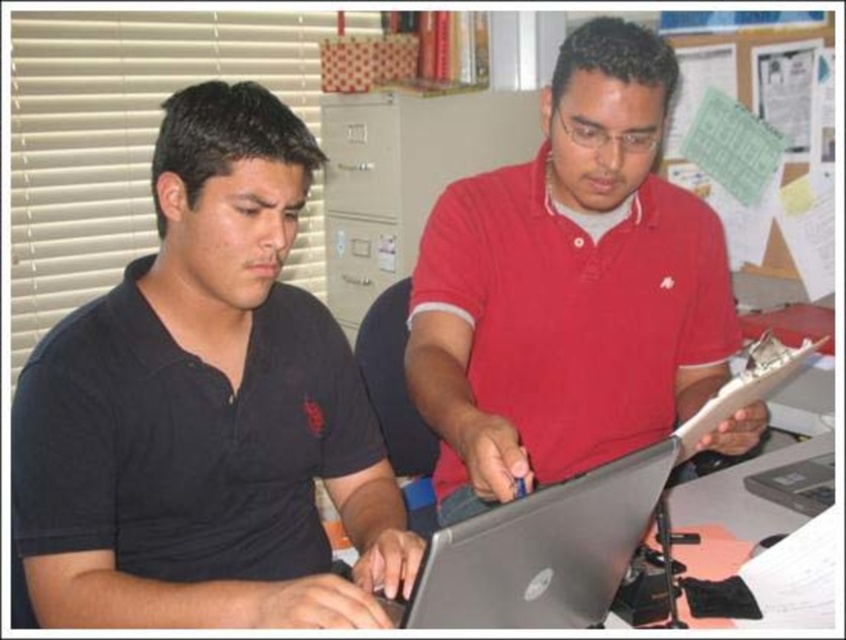
Question: Can you confirm if black matte shirt at left is wider than silver metallic laptop at center?

Choices:
 (A) no
 (B) yes

Answer: (B)

Question: Is silver metallic laptop at center positioned before white paper at lower right?

Choices:
 (A) yes
 (B) no

Answer: (A)

Question: Is matte red shirt at center closer to camera compared to matte gray file cabinet at center?

Choices:
 (A) yes
 (B) no

Answer: (A)

Question: Based on their relative distances, which object is farther from the white paper at lower right?

Choices:
 (A) black matte shirt at left
 (B) matte gray file cabinet at center
 (C) matte red shirt at center
 (D) silver metallic laptop at center

Answer: (B)

Question: Considering the real-world distances, which object is farthest from the black matte shirt at left?

Choices:
 (A) matte gray file cabinet at center
 (B) matte red shirt at center
 (C) white paper at lower right

Answer: (A)

Question: Which point is farther from the camera taking this photo?

Choices:
 (A) (820, 435)
 (B) (608, 509)
 (C) (424, 129)
 (D) (288, 298)

Answer: (C)